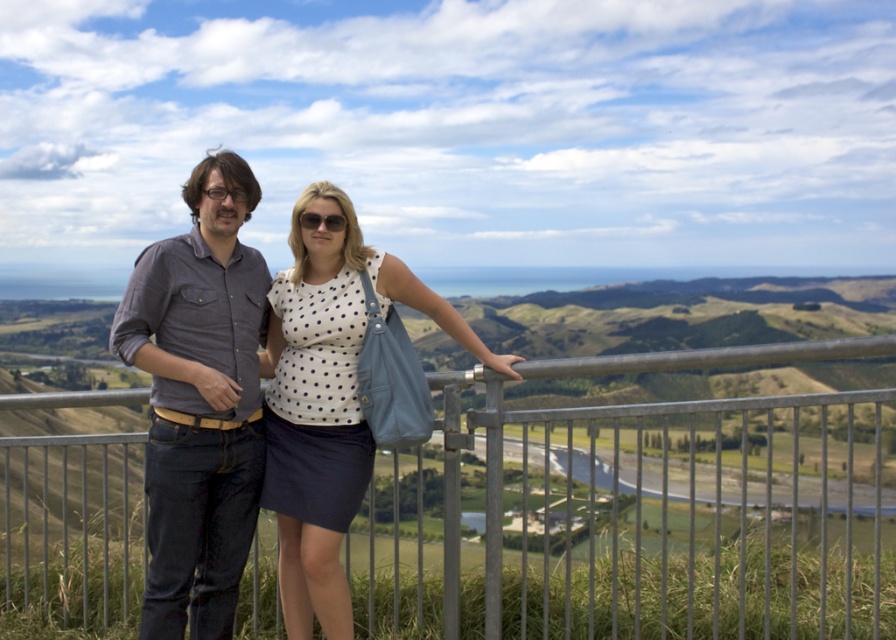
Is point (476, 602) positioned in front of point (342, 609)?

No.

Locate an element on the screen. This screenshot has height=640, width=896. metallic gray fence at center is located at coordinates (634, 518).

What are the coordinates of `metallic gray fence at center` in the screenshot? It's located at (634, 518).

Which is below, metallic gray fence at center or dark gray shirt at center?

Positioned lower is metallic gray fence at center.

I want to click on metallic gray fence at center, so click(x=634, y=518).

Measure the distance from dark gray shirt at center to white dotted fabric at center.

dark gray shirt at center and white dotted fabric at center are 26.81 inches apart from each other.

Between point (225, 289) and point (280, 506), which one is positioned behind?

Positioned behind is point (225, 289).

The width and height of the screenshot is (896, 640). I want to click on dark gray shirt at center, so click(199, 401).